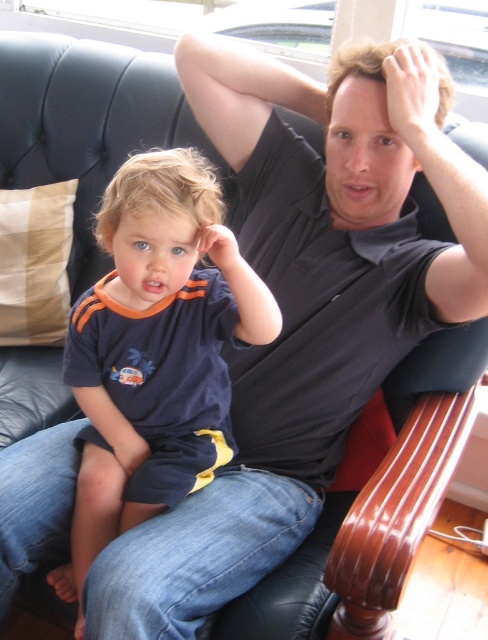
Question: From the image, what is the correct spatial relationship of smooth black hair at upper center in relation to blonde hair at center?

Choices:
 (A) above
 (B) below

Answer: (A)

Question: Among these objects, which one is farthest from the camera?

Choices:
 (A) matte blue t-shirt at left
 (B) blonde hair at center

Answer: (A)

Question: Which object is closer to the camera taking this photo?

Choices:
 (A) matte blue t-shirt at left
 (B) smooth black hair at upper center
 (C) blonde hair at center

Answer: (C)

Question: Which point is closer to the camera?

Choices:
 (A) blonde hair at center
 (B) smooth black hair at upper center
 (C) matte blue t-shirt at left

Answer: (A)

Question: Can you confirm if matte blue t-shirt at left is wider than blonde hair at center?

Choices:
 (A) no
 (B) yes

Answer: (B)

Question: Does matte blue t-shirt at left have a larger size compared to blonde hair at center?

Choices:
 (A) no
 (B) yes

Answer: (B)